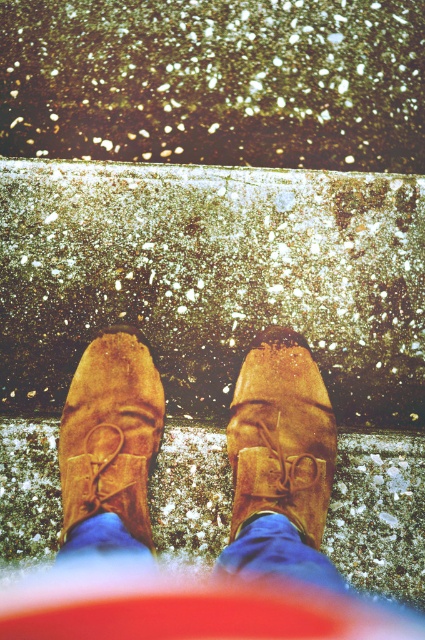
Question: Which object appears farthest from the camera in this image?

Choices:
 (A) brown suede shoe at center
 (B) suede brown shoe at center

Answer: (A)

Question: Among these points, which one is farthest from the camera?

Choices:
 (A) (158, 428)
 (B) (291, 360)

Answer: (B)

Question: Observing the image, what is the correct spatial positioning of suede brown shoe at center in reference to brown suede shoe at center?

Choices:
 (A) left
 (B) right

Answer: (A)

Question: Does suede brown shoe at center appear over brown suede shoe at center?

Choices:
 (A) no
 (B) yes

Answer: (A)

Question: Is suede brown shoe at center bigger than brown suede shoe at center?

Choices:
 (A) yes
 (B) no

Answer: (A)